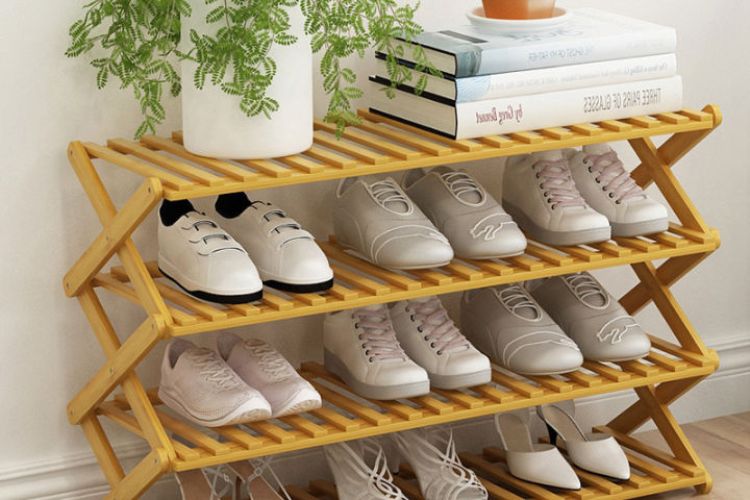
I want to click on wooden shelves, so click(656, 484), click(628, 378), click(595, 261), click(520, 150).